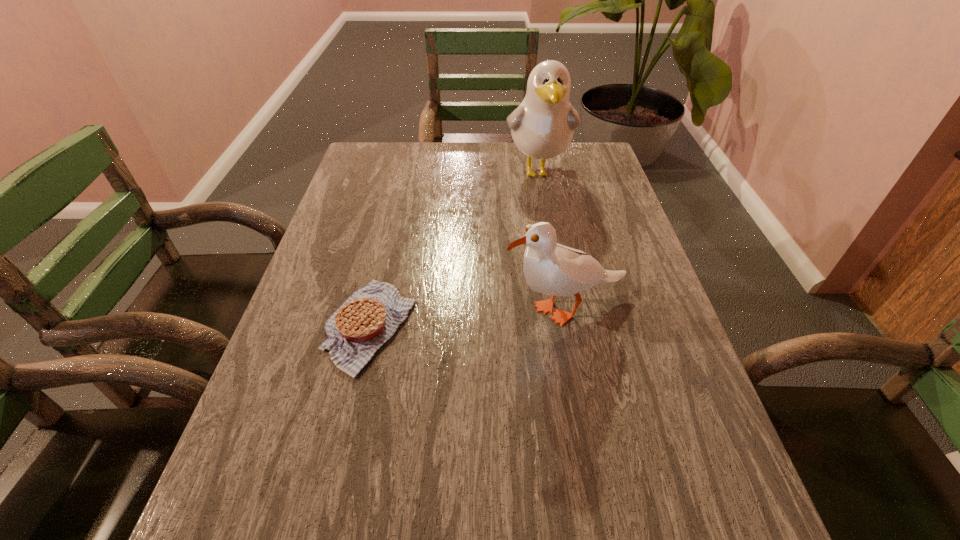
The image size is (960, 540). I want to click on blank space located on the right of the pie, so click(574, 326).

Find the location of a particular element. The height and width of the screenshot is (540, 960). object at the far edge is located at coordinates (542, 126).

Identify the location of object at the left edge. Image resolution: width=960 pixels, height=540 pixels. (366, 320).

Find the location of a particular element. The image size is (960, 540). object at the far right corner is located at coordinates (542, 126).

Locate an element on the screen. The width and height of the screenshot is (960, 540). free location at the far edge of the desktop is located at coordinates (497, 161).

Locate an element on the screen. This screenshot has height=540, width=960. vacant space at the left edge is located at coordinates (302, 446).

The height and width of the screenshot is (540, 960). In order to click on free region at the right edge of the desktop in this screenshot , I will do `click(667, 360)`.

At what (x,y) coordinates should I click in order to perform the action: click on vacant space at the far left corner. Please return your answer as a coordinate pair (x, y). This screenshot has width=960, height=540. Looking at the image, I should click on point(396,156).

Find the location of a particular element. The image size is (960, 540). free space at the far right corner of the desktop is located at coordinates (588, 168).

Where is `empty location between the tallest object and the shortest object`? The width and height of the screenshot is (960, 540). empty location between the tallest object and the shortest object is located at coordinates (454, 249).